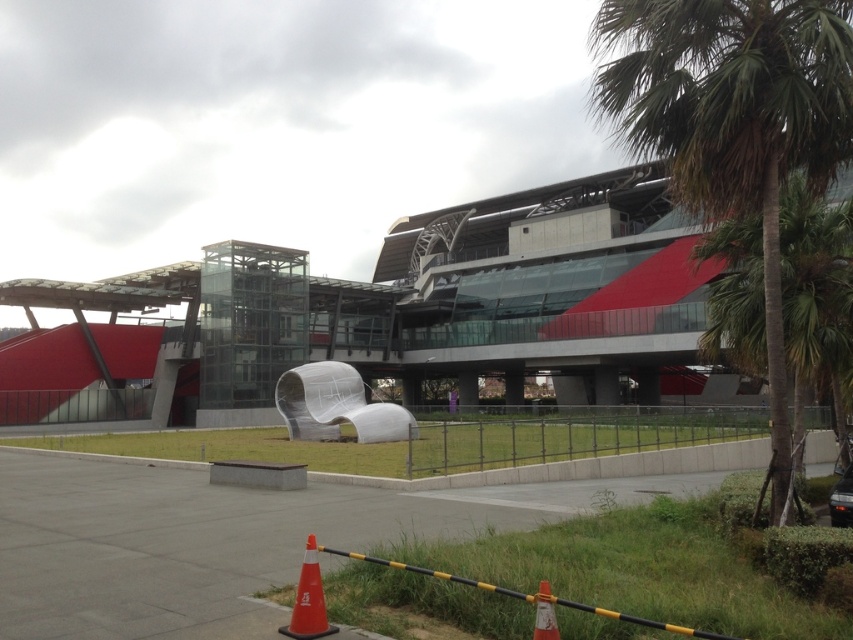
Question: Which of the following is the farthest from the observer?

Choices:
 (A) glassy modern building at center
 (B) orange matte traffic cone at lower center

Answer: (A)

Question: Is glassy modern building at center to the right of orange matte cone at lower center from the viewer's perspective?

Choices:
 (A) yes
 (B) no

Answer: (B)

Question: Estimate the real-world distances between objects in this image. Which object is farther from the orange matte traffic cone at lower center?

Choices:
 (A) orange matte cone at lower center
 (B) green leafy palm tree at right
 (C) glassy modern building at center

Answer: (C)

Question: Does glassy modern building at center appear over green leafy palm tree at right?

Choices:
 (A) yes
 (B) no

Answer: (B)

Question: Estimate the real-world distances between objects in this image. Which object is closer to the glassy modern building at center?

Choices:
 (A) orange matte cone at lower center
 (B) green leafy palm tree at right

Answer: (B)

Question: Is green leafy palm tree at right to the right of orange matte cone at lower center from the viewer's perspective?

Choices:
 (A) yes
 (B) no

Answer: (A)